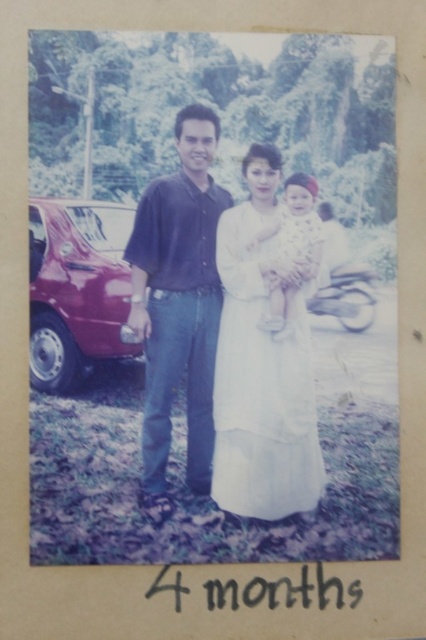
Based on the scene described, which object is taller between the shiny maroon car at left and the white fabric baby at center?

The shiny maroon car at left is taller than the white fabric baby at center according to the description.

Looking at this image, based on the scene described, where is the white satin dress at center located in the image?

The white satin dress at center is located at the 2D coordinates point (261, 364) in the image.